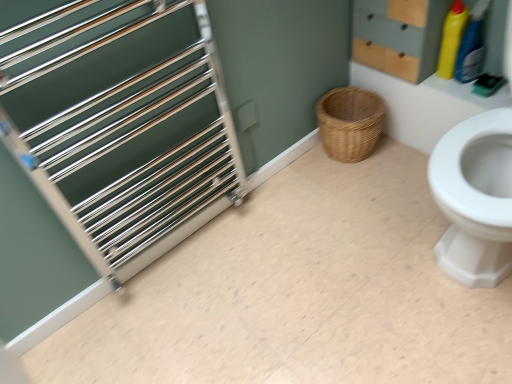
Question: Would you say brushed metal towel rack at left is part of yellow plastic bottle at upper right, which is the first cleaning product from left to right,'s contents?

Choices:
 (A) yes
 (B) no

Answer: (B)

Question: From a real-world perspective, is yellow plastic bottle at upper right, which is the first cleaning product from left to right, on brushed metal towel rack at left?

Choices:
 (A) yes
 (B) no

Answer: (A)

Question: Is yellow plastic bottle at upper right, placed as the second cleaning product when sorted from right to left, directly adjacent to brushed metal towel rack at left?

Choices:
 (A) yes
 (B) no

Answer: (B)

Question: Is yellow plastic bottle at upper right, which is the first cleaning product from left to right, positioned behind brushed metal towel rack at left?

Choices:
 (A) yes
 (B) no

Answer: (A)

Question: Considering the relative positions of yellow plastic bottle at upper right, placed as the second cleaning product when sorted from right to left, and brushed metal towel rack at left in the image provided, is yellow plastic bottle at upper right, placed as the second cleaning product when sorted from right to left, to the left of brushed metal towel rack at left from the viewer's perspective?

Choices:
 (A) yes
 (B) no

Answer: (B)

Question: Is point (353, 49) closer or farther from the camera than point (478, 74)?

Choices:
 (A) closer
 (B) farther

Answer: (B)

Question: From the image's perspective, is wooden drawer at upper right located above or below yellow plastic bottle at upper right, the 1th cleaning product when ordered from right to left?

Choices:
 (A) above
 (B) below

Answer: (A)

Question: From a real-world perspective, is wooden drawer at upper right physically located above or below yellow plastic bottle at upper right, arranged as the second cleaning product when viewed from the left?

Choices:
 (A) above
 (B) below

Answer: (A)

Question: Is wooden drawer at upper right taller or shorter than yellow plastic bottle at upper right, the 1th cleaning product when ordered from right to left?

Choices:
 (A) tall
 (B) short

Answer: (A)

Question: In terms of height, does brushed metal towel rack at left look taller or shorter compared to polished metal rack at left?

Choices:
 (A) short
 (B) tall

Answer: (A)

Question: Based on their sizes in the image, would you say brushed metal towel rack at left is bigger or smaller than polished metal rack at left?

Choices:
 (A) big
 (B) small

Answer: (B)

Question: From the image's perspective, relative to polished metal rack at left, is brushed metal towel rack at left above or below?

Choices:
 (A) above
 (B) below

Answer: (B)

Question: Is point (251, 211) positioned closer to the camera than point (49, 145)?

Choices:
 (A) closer
 (B) farther

Answer: (B)

Question: Based on their positions, is brushed metal towel rack at left located to the left or right of yellow plastic bottle at upper right, which is the first cleaning product from left to right?

Choices:
 (A) right
 (B) left

Answer: (B)

Question: Considering their positions, is brushed metal towel rack at left located in front of or behind yellow plastic bottle at upper right, which is the first cleaning product from left to right?

Choices:
 (A) behind
 (B) front

Answer: (B)